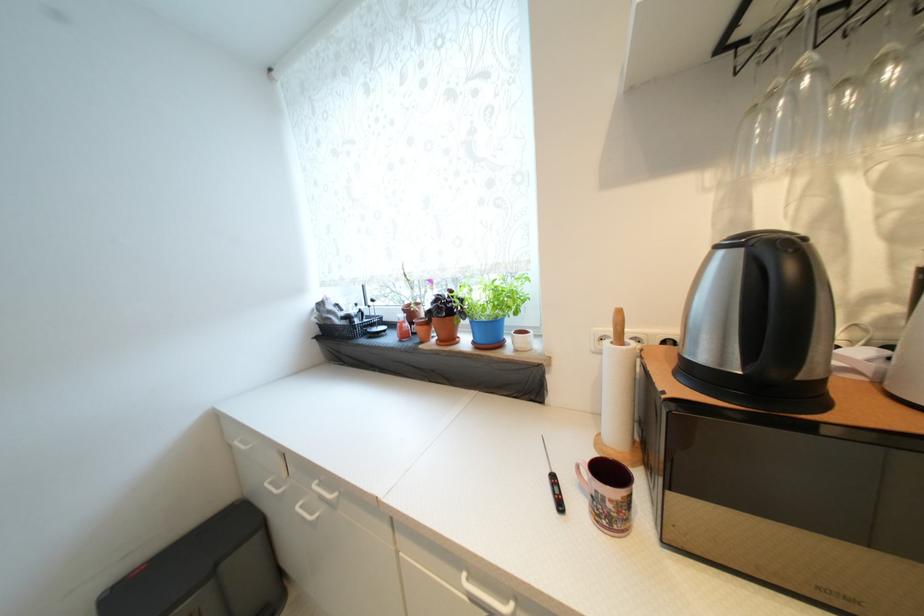
What do you see at coordinates (205, 573) in the screenshot? The image size is (924, 616). I see `a trash can pedal` at bounding box center [205, 573].